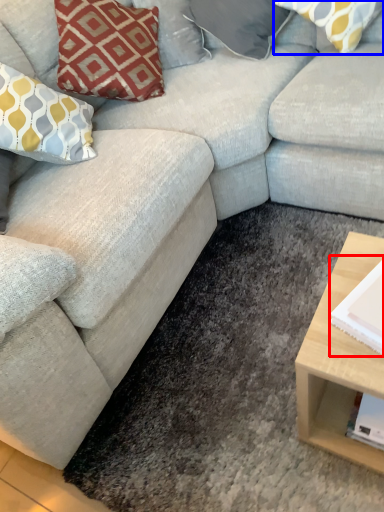
Question: Which point is further to the camera, magazine (highlighted by a red box) or pillow (highlighted by a blue box)?

Choices:
 (A) magazine
 (B) pillow

Answer: (B)